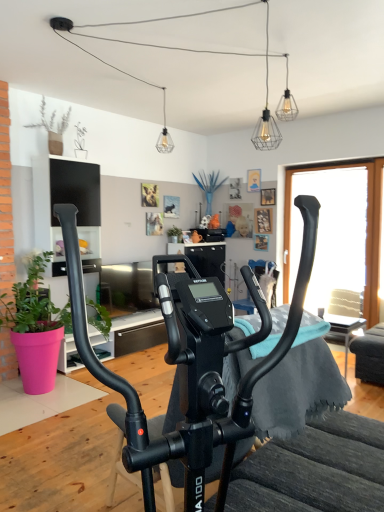
Question: Is the position of wire mesh bulb at upper center, which is the 3th light fixture from left to right, more distant than that of wire mesh light fixture at upper center, which is counted as the first light fixture, starting from the front?

Choices:
 (A) yes
 (B) no

Answer: (A)

Question: Can we say wire mesh bulb at upper center, the 2th light fixture when ordered from back to front, lies outside wire mesh light fixture at upper center, which ranks as the 2th light fixture in right-to-left order?

Choices:
 (A) no
 (B) yes

Answer: (B)

Question: Is wire mesh bulb at upper center, the 2th light fixture when ordered from back to front, aimed at wire mesh light fixture at upper center, which ranks as the 2th light fixture in right-to-left order?

Choices:
 (A) yes
 (B) no

Answer: (B)

Question: Considering the relative sizes of wire mesh bulb at upper center, the 2th light fixture when ordered from back to front, and wire mesh light fixture at upper center, which ranks as the 2th light fixture in right-to-left order, in the image provided, is wire mesh bulb at upper center, the 2th light fixture when ordered from back to front, taller than wire mesh light fixture at upper center, which ranks as the 2th light fixture in right-to-left order,?

Choices:
 (A) no
 (B) yes

Answer: (A)

Question: Can you confirm if wire mesh bulb at upper center, the 2th light fixture when ordered from back to front, is shorter than wire mesh light fixture at upper center, which ranks as the 2th light fixture in right-to-left order?

Choices:
 (A) yes
 (B) no

Answer: (A)

Question: Is wire mesh bulb at upper center, which appears as the 2th light fixture when viewed from the front, directly adjacent to wire mesh light fixture at upper center, which is counted as the first light fixture, starting from the front?

Choices:
 (A) yes
 (B) no

Answer: (B)

Question: Considering the relative positions of clear glass pendant light at upper center, which is counted as the third light fixture, starting from the right, and transparent glass window at right in the image provided, is clear glass pendant light at upper center, which is counted as the third light fixture, starting from the right, to the left of transparent glass window at right from the viewer's perspective?

Choices:
 (A) yes
 (B) no

Answer: (A)

Question: Does clear glass pendant light at upper center, marked as the third light fixture in a front-to-back arrangement, have a lesser height compared to transparent glass window at right?

Choices:
 (A) yes
 (B) no

Answer: (A)

Question: Is clear glass pendant light at upper center, marked as the third light fixture in a front-to-back arrangement, far away from transparent glass window at right?

Choices:
 (A) yes
 (B) no

Answer: (A)

Question: Does clear glass pendant light at upper center, positioned as the 1th light fixture in back-to-front order, appear on the right side of transparent glass window at right?

Choices:
 (A) yes
 (B) no

Answer: (B)

Question: From a real-world perspective, is clear glass pendant light at upper center, which is counted as the third light fixture, starting from the right, positioned under transparent glass window at right based on gravity?

Choices:
 (A) no
 (B) yes

Answer: (A)

Question: Does clear glass pendant light at upper center, marked as the third light fixture in a front-to-back arrangement, have a greater height compared to transparent glass window at right?

Choices:
 (A) no
 (B) yes

Answer: (A)

Question: Is pink matte plant pot at left, acting as the second houseplant starting from the top, surrounded by green matte plant at center, the 2th houseplant in the bottom-to-top sequence?

Choices:
 (A) no
 (B) yes

Answer: (A)